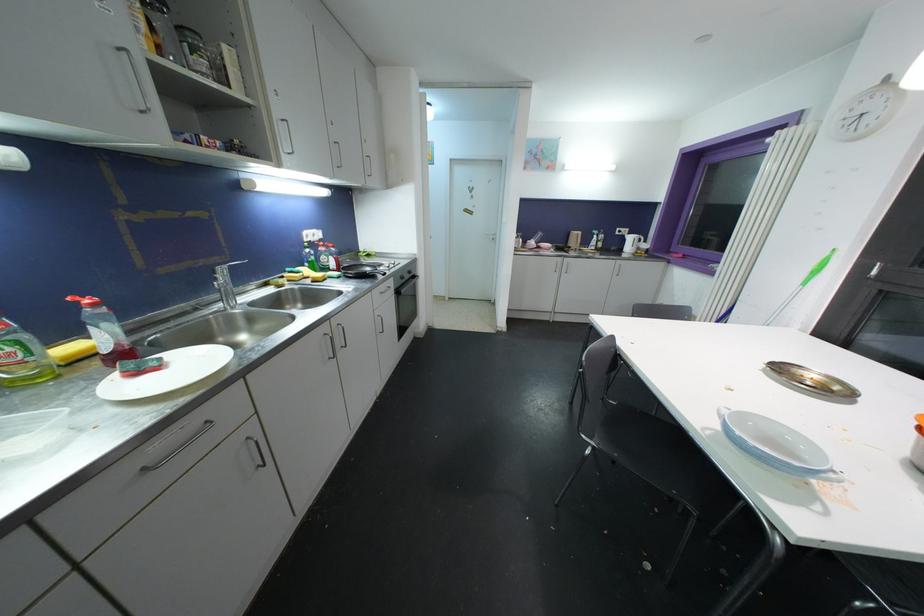
Image resolution: width=924 pixels, height=616 pixels. In order to click on faucet handle in this screenshot , I will do `click(223, 274)`.